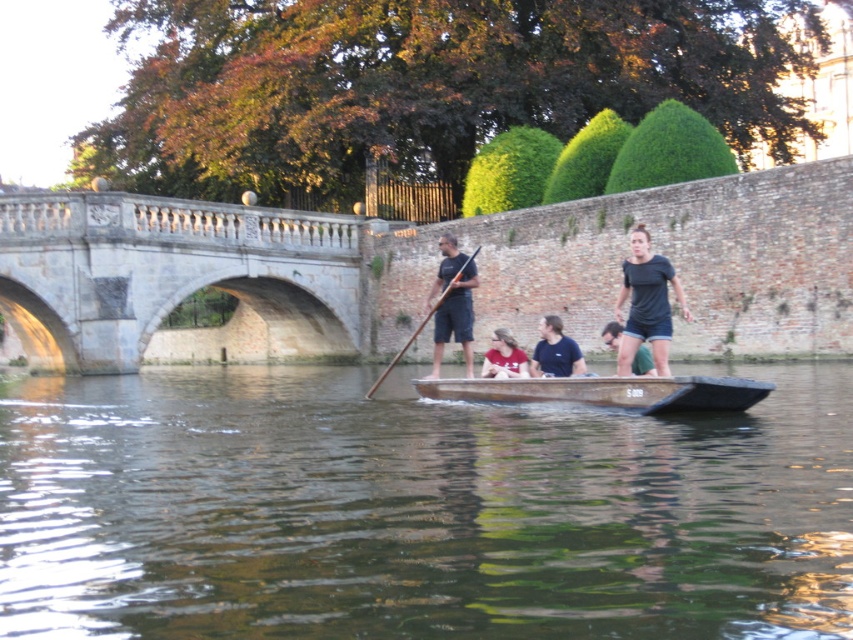
Question: From the image, what is the correct spatial relationship of matte black paddle at center in relation to matte black shirt at center?

Choices:
 (A) above
 (B) below

Answer: (A)

Question: Is wooden canoe at center above brown wooden paddle at center?

Choices:
 (A) no
 (B) yes

Answer: (A)

Question: Can you confirm if stone arch bridge at center is positioned above matte black shirt at center?

Choices:
 (A) yes
 (B) no

Answer: (A)

Question: Which point is farther to the camera?

Choices:
 (A) (86, 324)
 (B) (682, 289)
 (C) (461, 268)
 (D) (547, 324)

Answer: (A)

Question: Which of these objects is positioned closest to the wooden canoe at center?

Choices:
 (A) brown wooden paddle at center
 (B) matte red shirt at center
 (C) matte black paddle at center

Answer: (B)

Question: Among these objects, which one is nearest to the camera?

Choices:
 (A) stone arch bridge at center
 (B) brown wooden paddle at center

Answer: (B)